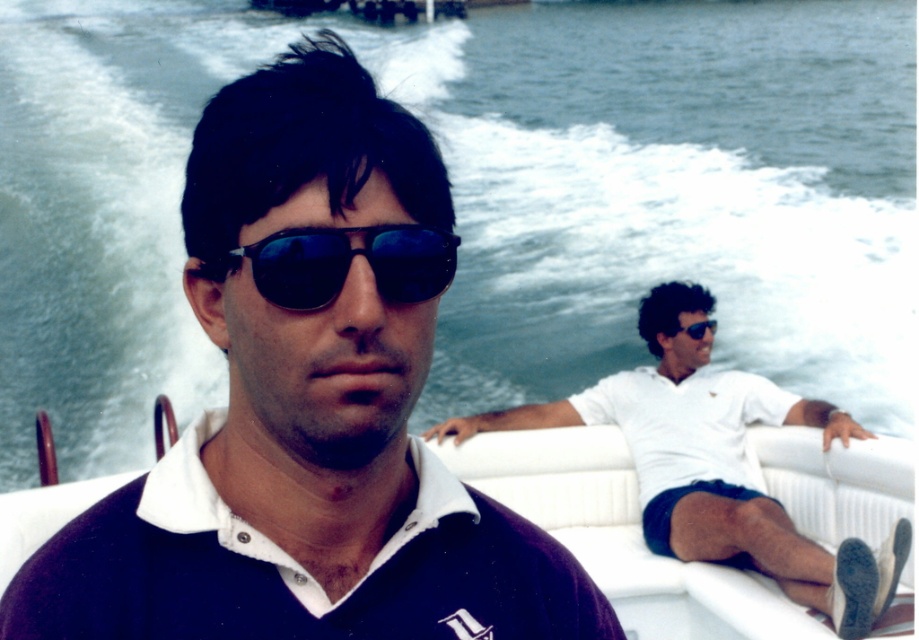
Question: Where is white matte polo shirt at right located in relation to black reflective sunglasses at center in the image?

Choices:
 (A) below
 (B) above

Answer: (A)

Question: Is matte black sunglasses at center thinner than navy blue cotton polo shirt at center?

Choices:
 (A) yes
 (B) no

Answer: (B)

Question: Where is navy blue cotton polo shirt at center located in relation to black reflective sunglasses at center in the image?

Choices:
 (A) left
 (B) right

Answer: (B)

Question: Among these points, which one is farthest from the camera?

Choices:
 (A) (305, 241)
 (B) (848, 426)
 (C) (768, 417)
 (D) (405, 580)

Answer: (C)

Question: Which object appears closest to the camera in this image?

Choices:
 (A) matte black sunglasses at center
 (B) black reflective sunglasses at upper center
 (C) black reflective sunglasses at center

Answer: (A)

Question: Which object is positioned farthest from the white matte polo shirt at right?

Choices:
 (A) black reflective sunglasses at upper center
 (B) black reflective sunglasses at center

Answer: (B)